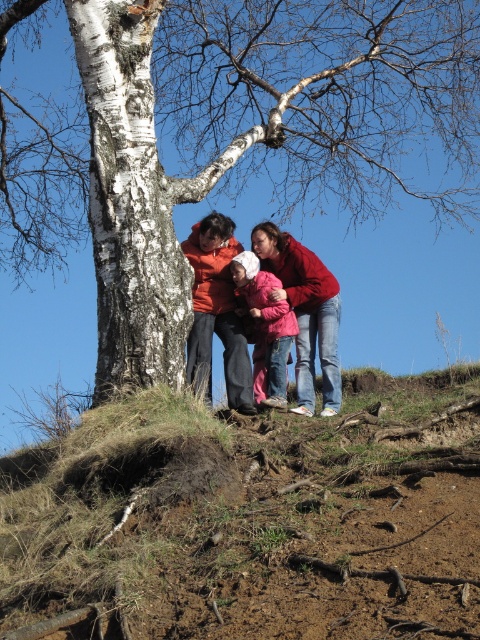
From the picture: You are a photographer trying to capture a photo of the matte orange sweater at center and the dried grass at center. Which object is located to the left of the other?

The dried grass at center is positioned on the left side of matte orange sweater at center.

You are planning to set up a picnic blanket in the area shown in the image. The blanket requires a space that is at least 5 meters away from any trees to avoid branches. Given the distance between the dried grass at center and the white bark tree at center, can you safely place the picnic blanket there?

The dried grass at center is 7.32 meters away from the white bark tree at center. Since the required distance is at least 5 meters, the picnic blanket can be safely placed there as the distance meets the requirement.

You are a photographer wanting to capture the group under the tree. Since the white bark tree at center is above the pink fleece jacket at center, will the group be in direct sunlight or shade?

Result: The white bark tree at center is above the pink fleece jacket at center, so the group is likely in shade beneath the tree.